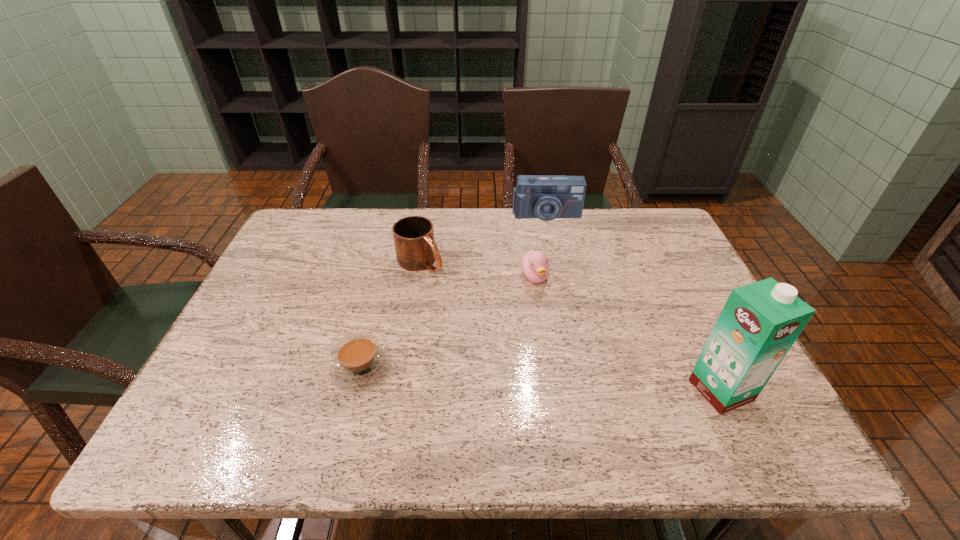
The image size is (960, 540). Find the location of `object that is the closest to the shortest object`. object that is the closest to the shortest object is located at coordinates (415, 247).

Locate which object ranks in proximity to the carton. Please provide its 2D coordinates. Your answer should be formatted as a tuple, i.e. [(x, y)], where the tuple contains the x and y coordinates of a point satisfying the conditions above.

[(535, 265)]

You are a GUI agent. You are given a task and a screenshot of the screen. Output one action in this format:
    pyautogui.click(x=<x>, y=<y>)
    Task: Click on the free space that satisfies the following two spatial constraints: 1. on the front side of the fourth shortest object; 2. on the left side of the carton
    
    Given the screenshot: What is the action you would take?
    pyautogui.click(x=582, y=390)

Identify the location of free location that satisfies the following two spatial constraints: 1. on the back side of the second tallest object; 2. on the left side of the fourth tallest object. Image resolution: width=960 pixels, height=540 pixels. (526, 215).